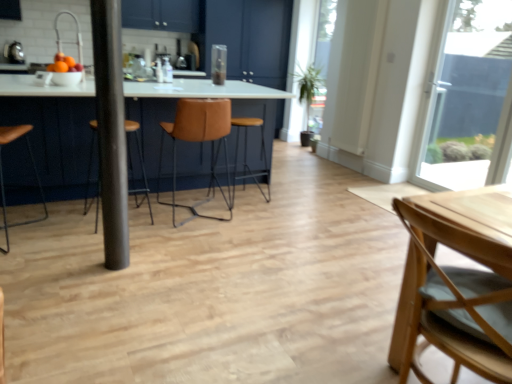
The height and width of the screenshot is (384, 512). I want to click on vacant space that is to the left of metallic pole at center, so click(86, 259).